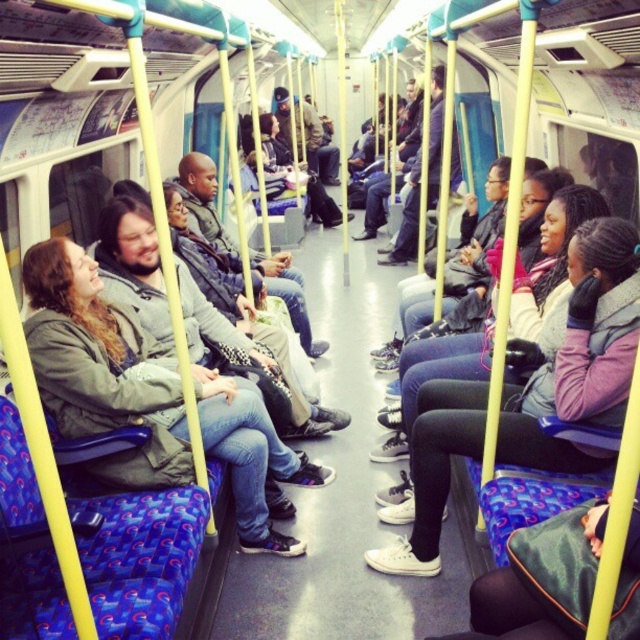
Question: Is green fabric jacket at left wider than white matte sneakers at center?

Choices:
 (A) yes
 (B) no

Answer: (A)

Question: Does green fabric jacket at left appear under white matte sneakers at center?

Choices:
 (A) yes
 (B) no

Answer: (A)

Question: Which point appears closest to the camera in this image?

Choices:
 (A) [x=268, y=419]
 (B) [x=592, y=308]

Answer: (B)

Question: Which point is farther from the camera taking this photo?

Choices:
 (A) (552, 387)
 (B) (264, 502)

Answer: (B)

Question: Can you confirm if green fabric jacket at left is wider than white matte sneakers at center?

Choices:
 (A) no
 (B) yes

Answer: (B)